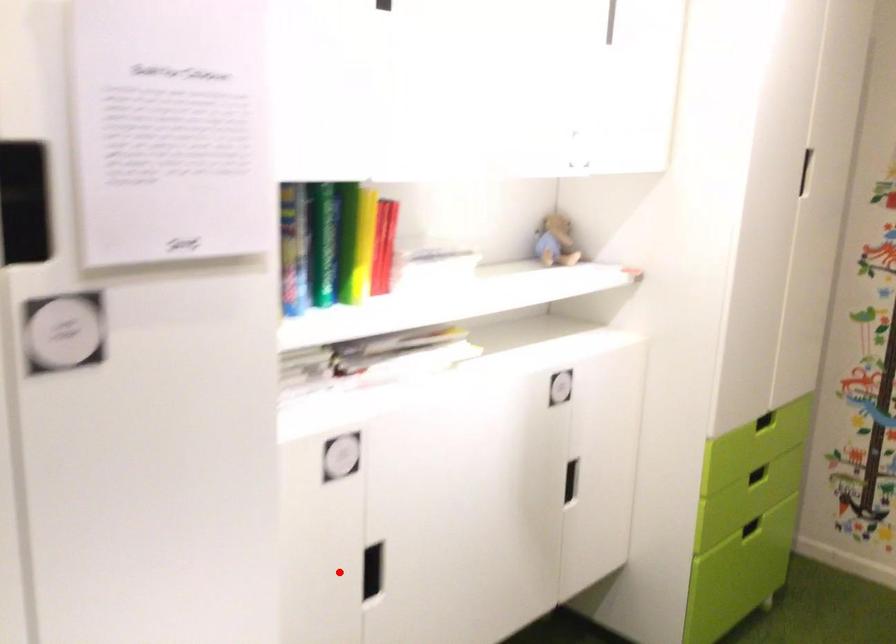
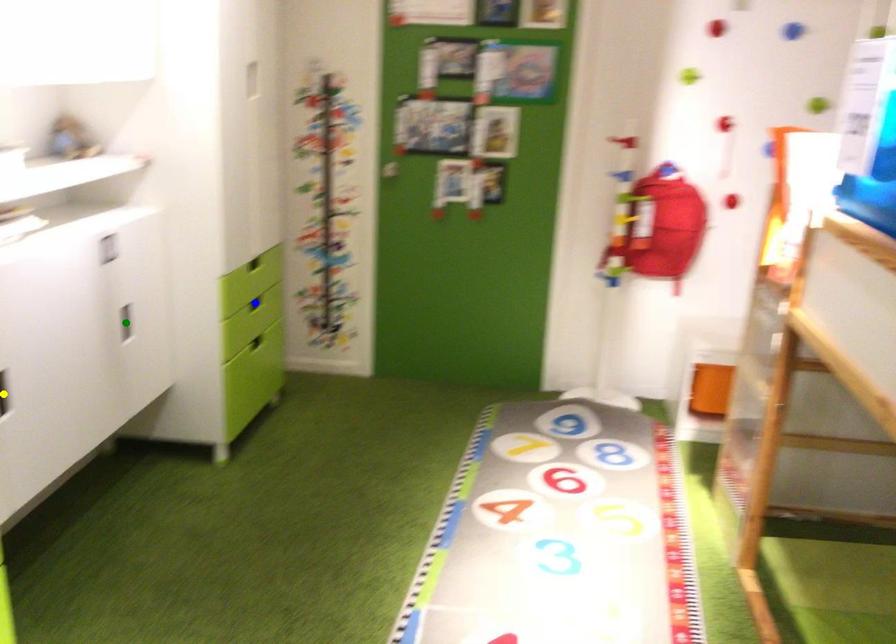
Question: I am providing you with two images of the same scene from different viewpoints. A red point is marked on the first image. You are given multiple points on the second image. Which mark in image 2 goes with the point in image 1?

Choices:
 (A) green point
 (B) blue point
 (C) yellow point

Answer: (C)